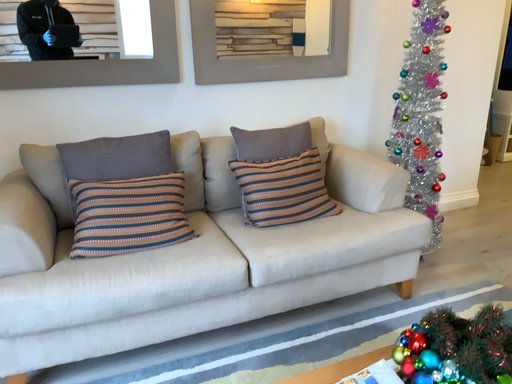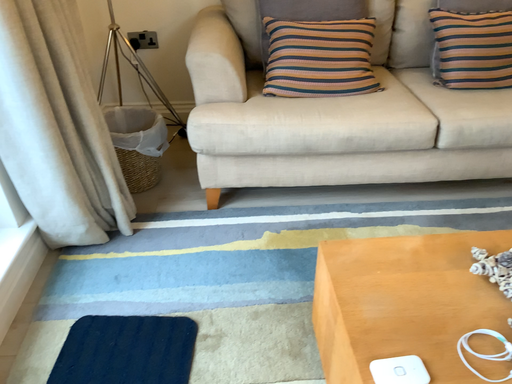
Question: Which way did the camera rotate in the video?

Choices:
 (A) rotated right
 (B) rotated left

Answer: (B)